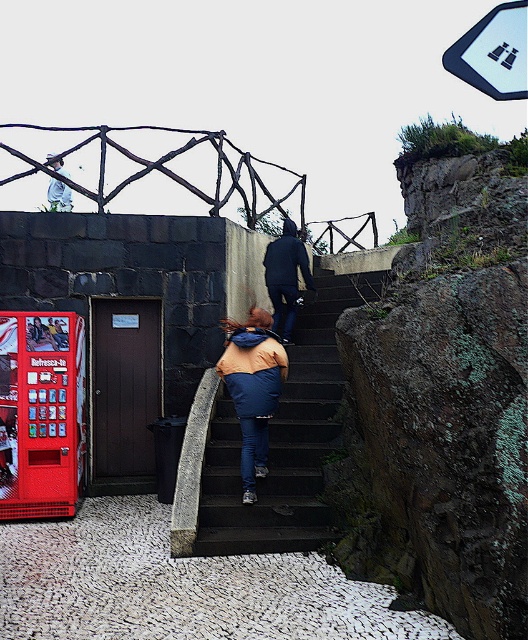
You are carrying a large box that is 1.2 meters wide and need to go up the dark gray concrete stairs at center. There is a person wearing a matte black jacket at upper center already on the stairs. Can you safely pass them while carrying the box?

The dark gray concrete stairs at center might be wider than matte black jacket at upper center, so it is possible to safely pass the person wearing the matte black jacket at upper center while carrying the large box, provided the stairs have enough width to accommodate both the box and the person.

You are standing at the base of the hill where the paved pathway begins. You want to reach the structure with the vending machine. Which direction should you walk to approach the dark gray concrete stairs at center?

You should walk towards the center to approach the dark gray concrete stairs at center since they are located at point (285,438).

You are standing at the bottom of the dark gray concrete stairs at center and want to hand a note to the person wearing the matte black jacket at upper center. Can you directly hand them the note without them having to come down the stairs?

The dark gray concrete stairs at center is closer to the viewer than the matte black jacket at upper center, so the person wearing the matte black jacket at upper center is further away. You cannot directly hand them the note without them coming down the stairs.